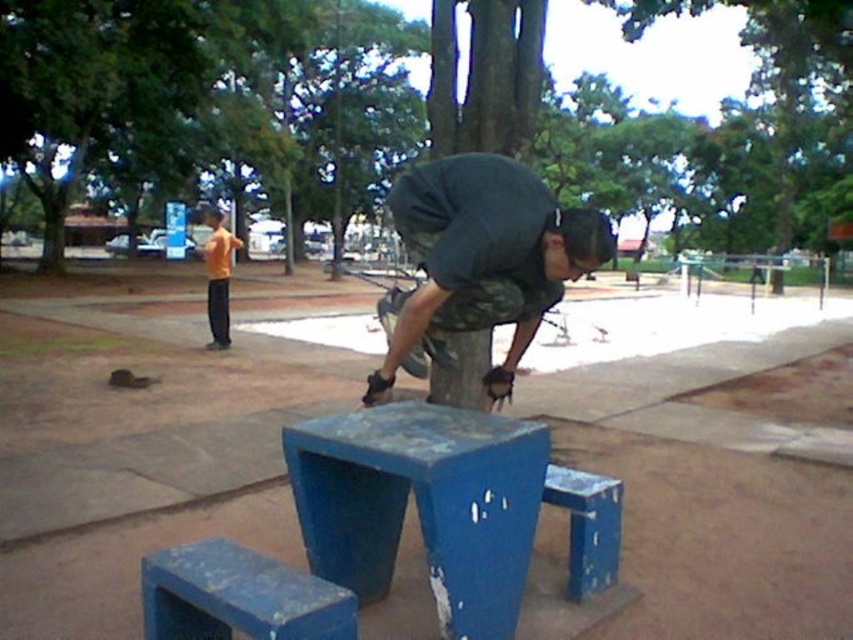
Can you confirm if blue painted wood step stool at lower center is positioned above blue painted wood step stool at lower right?

Yes, blue painted wood step stool at lower center is above blue painted wood step stool at lower right.

Between blue painted wood step stool at lower center and blue painted wood step stool at lower right, which one is positioned lower?

Positioned lower is blue painted wood step stool at lower right.

Identify the location of blue painted wood step stool at lower center. Image resolution: width=853 pixels, height=640 pixels. (238, 596).

Where is `blue painted wood step stool at lower center`? blue painted wood step stool at lower center is located at coordinates (238, 596).

Is camouflage pants at center to the left of orange shirt at left from the viewer's perspective?

Incorrect, camouflage pants at center is not on the left side of orange shirt at left.

Who is taller, camouflage pants at center or orange shirt at left?

orange shirt at left is taller.

Identify the location of camouflage pants at center. This screenshot has height=640, width=853. (485, 256).

Between point (502, 362) and point (195, 624), which one is positioned in front?

Point (195, 624)

Which is more to the right, camouflage pants at center or blue painted wood step stool at lower center?

Positioned to the right is camouflage pants at center.

Which is in front, point (515, 321) or point (171, 561)?

Positioned in front is point (171, 561).

In order to click on camouflage pants at center in this screenshot , I will do `click(485, 256)`.